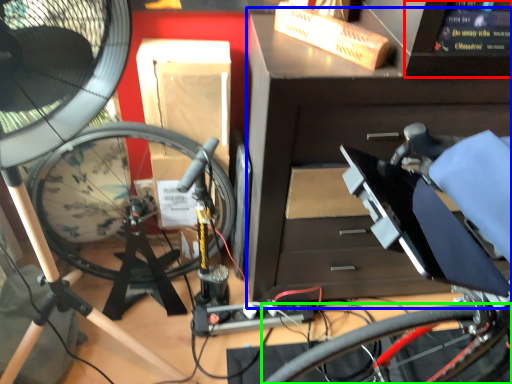
Question: Which is farther away from computer screen (highlighted by a red box)? workbench (highlighted by a blue box) or bicycle wheel (highlighted by a green box)?

Choices:
 (A) workbench
 (B) bicycle wheel

Answer: (B)